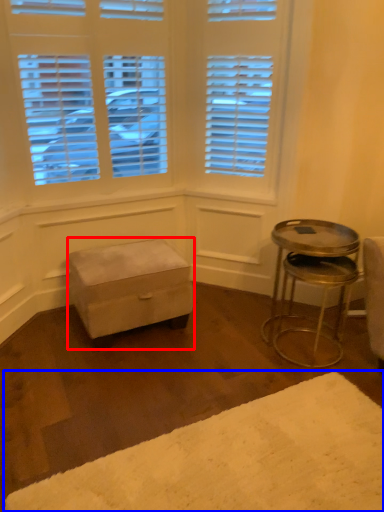
Question: Which of the following is the closest to the observer, stool (highlighted by a red box) or plain (highlighted by a blue box)?

Choices:
 (A) stool
 (B) plain

Answer: (B)